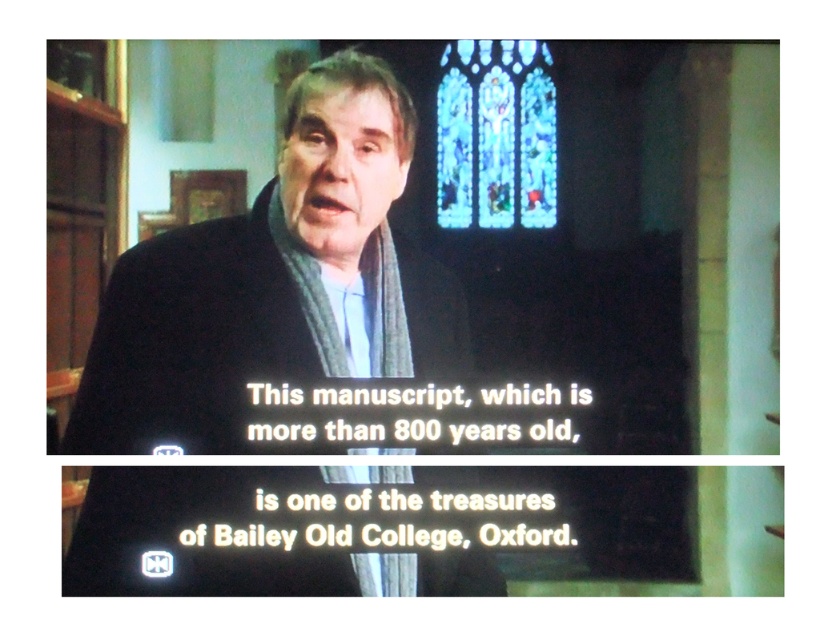
Which is behind, point (237, 451) or point (481, 65)?

Point (481, 65)

What do you see at coordinates (276, 285) in the screenshot?
I see `dark blue woolen scarf at center` at bounding box center [276, 285].

The height and width of the screenshot is (640, 820). I want to click on dark blue woolen scarf at center, so click(276, 285).